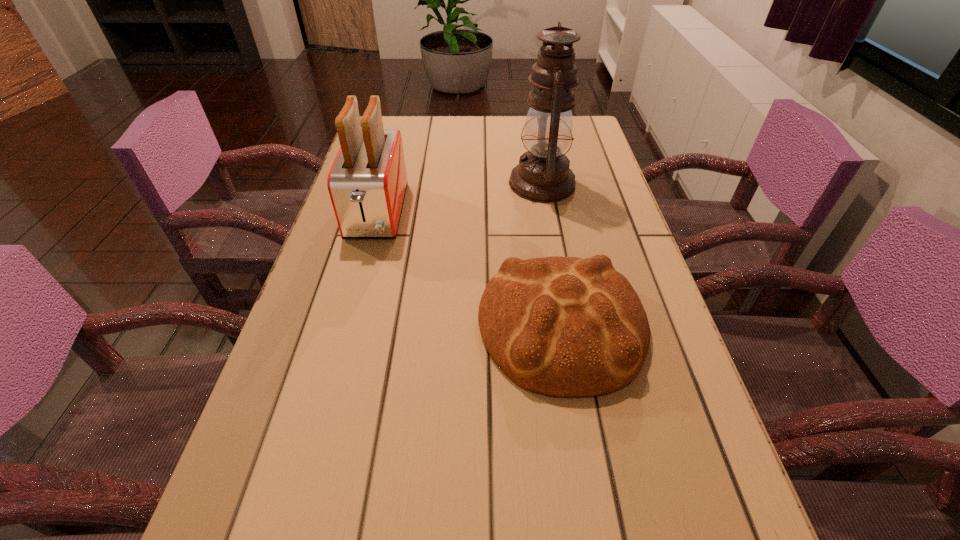
Identify the location of object that is the closest one to the shortest object. The image size is (960, 540). (367, 183).

The image size is (960, 540). What are the coordinates of `vacant point that satisfies the following two spatial constraints: 1. on the front-facing side of the bread; 2. on the left side of the leftmost object` in the screenshot? It's located at (346, 325).

Locate an element on the screen. The width and height of the screenshot is (960, 540). vacant space that satisfies the following two spatial constraints: 1. on the front-facing side of the shortest object; 2. on the left side of the toaster is located at coordinates 346,325.

This screenshot has width=960, height=540. I want to click on free space that satisfies the following two spatial constraints: 1. on the front-facing side of the shortest object; 2. on the left side of the second shortest object, so click(x=346, y=325).

Where is `vacant space that satisfies the following two spatial constraints: 1. on the front-facing side of the nearest object; 2. on the left side of the second tallest object`? The height and width of the screenshot is (540, 960). vacant space that satisfies the following two spatial constraints: 1. on the front-facing side of the nearest object; 2. on the left side of the second tallest object is located at coordinates (346, 325).